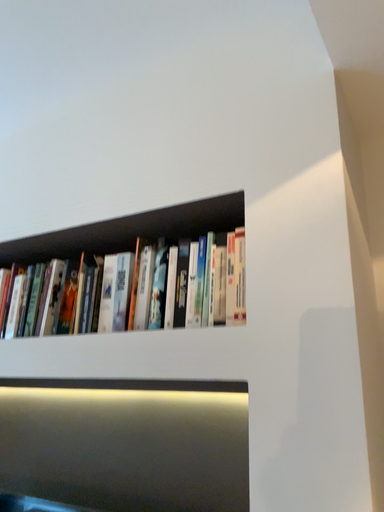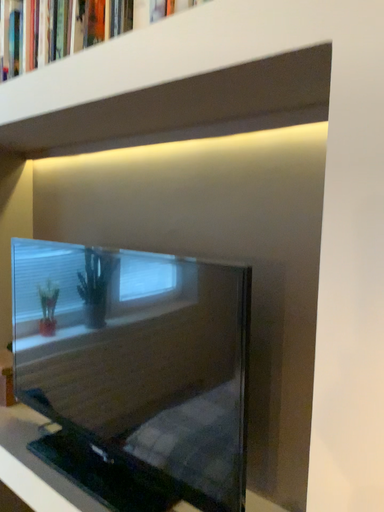
Question: How did the camera likely rotate when shooting the video?

Choices:
 (A) rotated downward
 (B) rotated upward

Answer: (A)